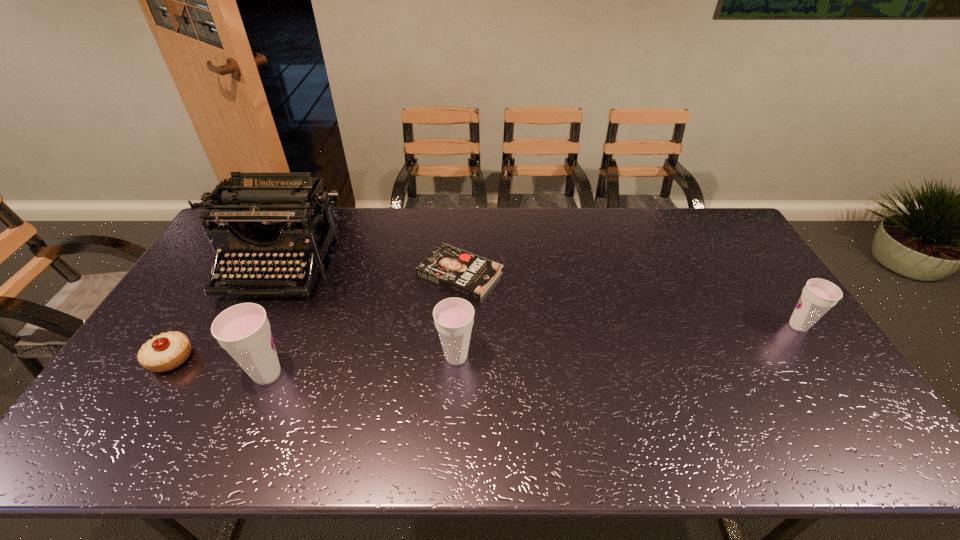
This screenshot has height=540, width=960. In order to click on free point between the typewriter and the book in this screenshot , I will do [370, 270].

At what (x,y) coordinates should I click in order to perform the action: click on vacant area between the rightmost cup and the pastry. Please return your answer as a coordinate pair (x, y). Looking at the image, I should click on (485, 342).

Where is `vacant area that lies between the book and the typewriter`? The height and width of the screenshot is (540, 960). vacant area that lies between the book and the typewriter is located at coordinates (370, 270).

Locate which object ranks fifth in proximity to the fifth tallest object. Please provide its 2D coordinates. Your answer should be formatted as a tuple, i.e. [(x, y)], where the tuple contains the x and y coordinates of a point satisfying the conditions above.

[(818, 296)]

The image size is (960, 540). What are the coordinates of `the fifth closest object to the fourth shortest object` in the screenshot? It's located at (818, 296).

Identify which cup is the nearest to the third shortest object. Please provide its 2D coordinates. Your answer should be formatted as a tuple, i.e. [(x, y)], where the tuple contains the x and y coordinates of a point satisfying the conditions above.

[(454, 317)]

Identify which cup is located as the third nearest to the second shortest object. Please provide its 2D coordinates. Your answer should be formatted as a tuple, i.e. [(x, y)], where the tuple contains the x and y coordinates of a point satisfying the conditions above.

[(818, 296)]

Where is `blank space that satisfies the following two spatial constraints: 1. on the back side of the second cup from left to right; 2. on the left side of the leftmost cup`? This screenshot has height=540, width=960. blank space that satisfies the following two spatial constraints: 1. on the back side of the second cup from left to right; 2. on the left side of the leftmost cup is located at coordinates (275, 357).

Where is `blank space that satisfies the following two spatial constraints: 1. on the back side of the pastry; 2. on the left side of the farthest cup`? blank space that satisfies the following two spatial constraints: 1. on the back side of the pastry; 2. on the left side of the farthest cup is located at coordinates (192, 326).